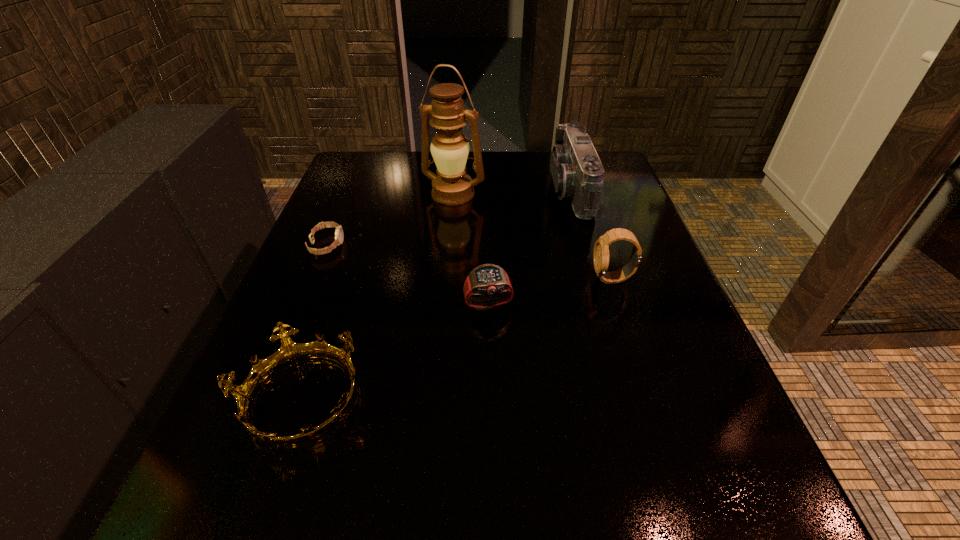
Locate an element on the screen. The image size is (960, 540). vacant space at the far left corner of the desktop is located at coordinates (400, 154).

Locate an element on the screen. The height and width of the screenshot is (540, 960). vacant region at the near right corner of the desktop is located at coordinates (750, 530).

Find the location of a particular element. vacant space that is in between the rightmost watch and the tallest object is located at coordinates (533, 237).

Where is `free space between the fifth farthest object and the fifth shortest object`? The image size is (960, 540). free space between the fifth farthest object and the fifth shortest object is located at coordinates (530, 247).

The image size is (960, 540). I want to click on empty space between the shortest object and the third tallest object, so click(469, 262).

You are a GUI agent. You are given a task and a screenshot of the screen. Output one action in this format:
    pyautogui.click(x=<x>, y=<y>)
    Task: Click on the free space between the leftmost watch and the fifth shortest object
    
    Given the screenshot: What is the action you would take?
    pyautogui.click(x=449, y=218)

This screenshot has height=540, width=960. In order to click on free space between the camcorder and the second watch from left to right in this screenshot , I will do `click(530, 247)`.

Find the location of a particular element. This screenshot has width=960, height=540. free space between the fourth farthest object and the tallest object is located at coordinates (533, 237).

Find the location of a particular element. The height and width of the screenshot is (540, 960). free space between the second watch from right to left and the nearest object is located at coordinates click(394, 352).

Locate an element on the screen. vacant area that lies between the crown and the third tallest object is located at coordinates (456, 339).